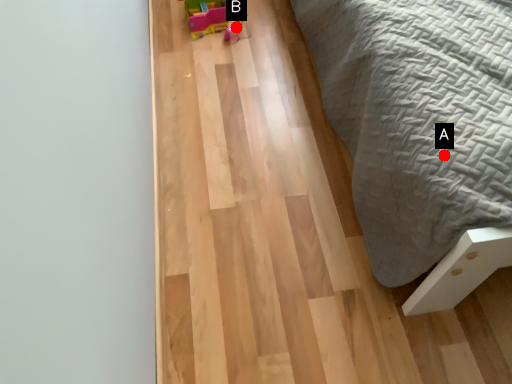
Question: Two points are circled on the image, labeled by A and B beside each circle. Which point appears farthest from the camera in this image?

Choices:
 (A) A is further
 (B) B is further

Answer: (B)